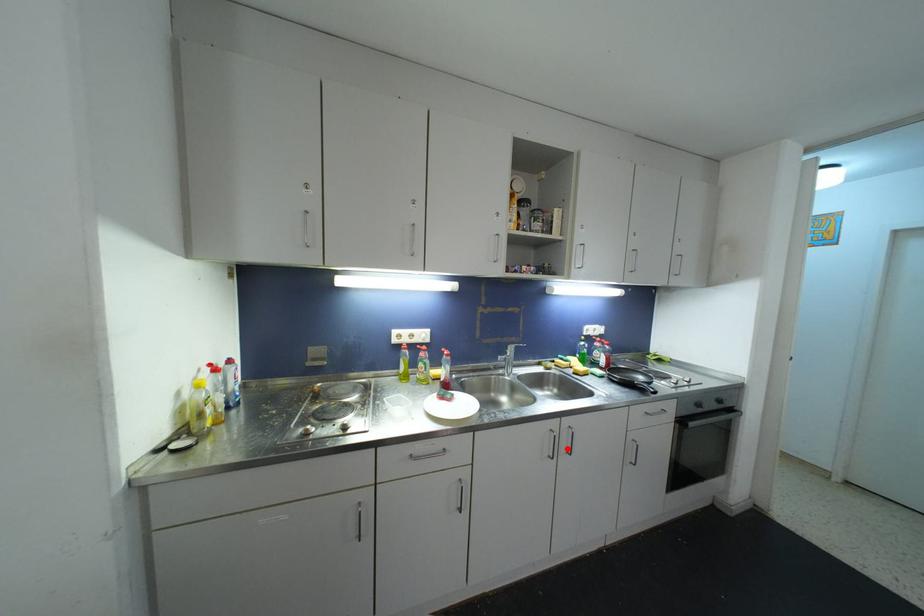
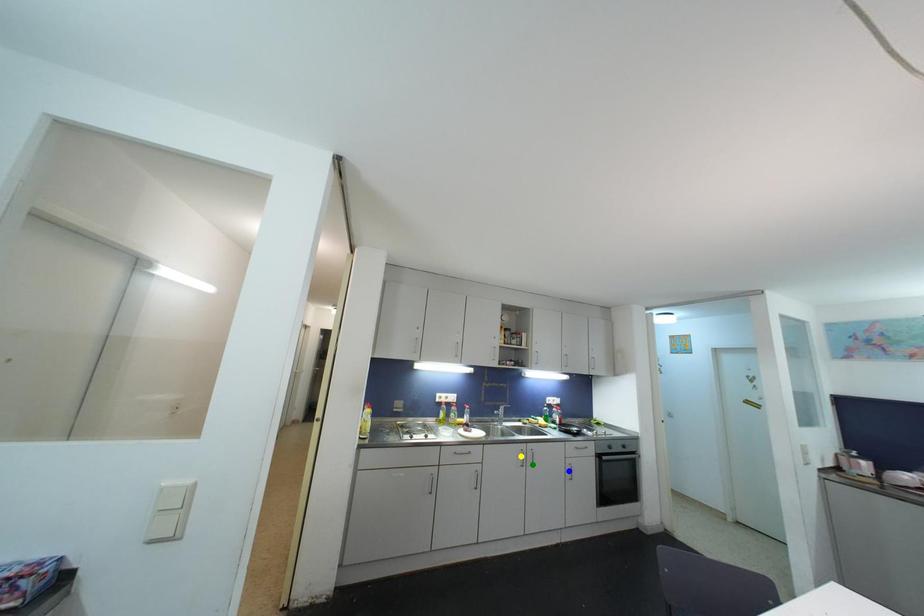
Question: I am providing you with two images of the same scene from different viewpoints. A red point is marked on the first image. You are given multiple points on the second image. Which spot in image 2 lines up with the point in image 1?

Choices:
 (A) yellow point
 (B) blue point
 (C) green point

Answer: (C)